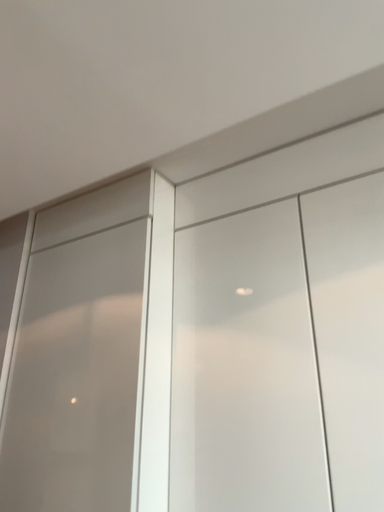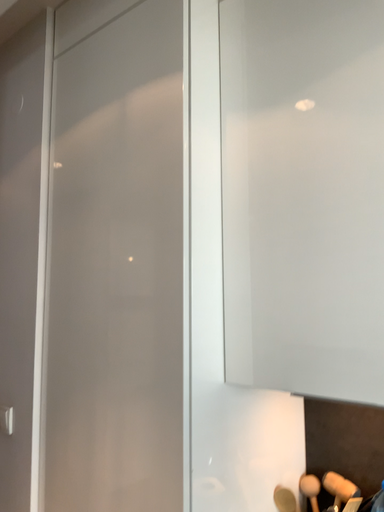
Question: How did the camera likely rotate when shooting the video?

Choices:
 (A) rotated downward
 (B) rotated upward

Answer: (A)